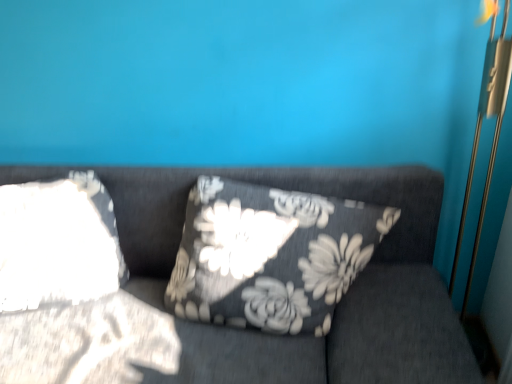
What is the approximate height of dark fabric cushion at center?

dark fabric cushion at center is 95.06 centimeters tall.

The height and width of the screenshot is (384, 512). What do you see at coordinates (337, 305) in the screenshot?
I see `dark fabric cushion at center` at bounding box center [337, 305].

You are a GUI agent. You are given a task and a screenshot of the screen. Output one action in this format:
    pyautogui.click(x=<x>, y=<y>)
    Task: Click on the dark fabric cushion at center
    This screenshot has height=384, width=512.
    Given the screenshot: What is the action you would take?
    pyautogui.click(x=337, y=305)

In order to face dark fabric cushion at center, should I rotate leftwards or rightwards?

Rotate left and turn 15.802 degrees.

Locate an element on the screen. dark fabric cushion at center is located at coordinates (337, 305).